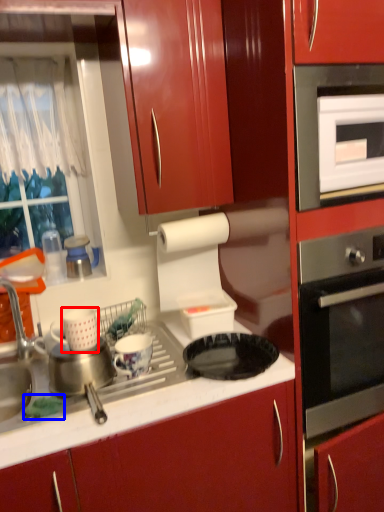
Question: Among these objects, which one is farthest to the camera, appliance (highlighted by a red box) or food (highlighted by a blue box)?

Choices:
 (A) appliance
 (B) food

Answer: (A)